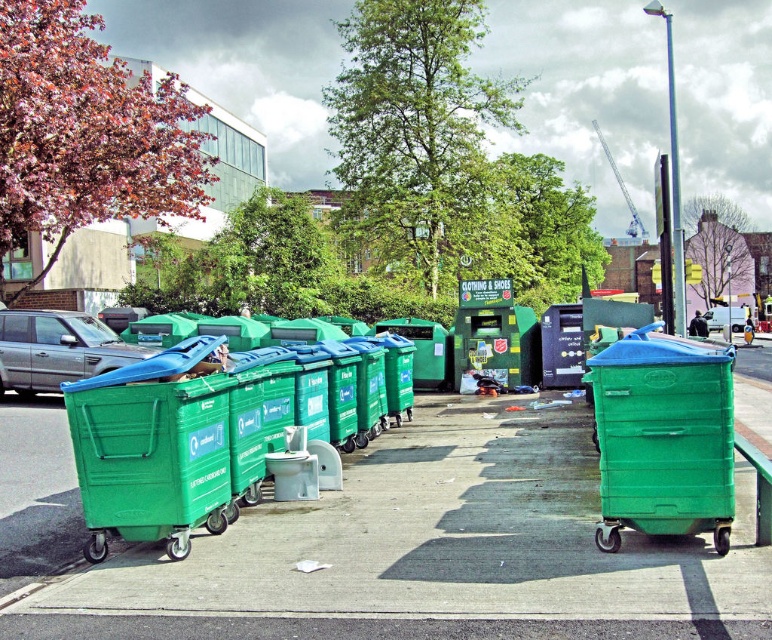
Question: From the image, what is the correct spatial relationship of green plastic pavement at center in relation to green plastic recycling bin at left?

Choices:
 (A) left
 (B) right

Answer: (B)

Question: Is green plastic recycling bin at left in front of silver metallic car at left?

Choices:
 (A) no
 (B) yes

Answer: (B)

Question: Which point is farther from the camera taking this photo?

Choices:
 (A) (80, 468)
 (B) (567, 592)
 (C) (174, 378)
 (D) (12, 376)

Answer: (D)

Question: Is green plastic pavement at center below green plastic bin at center?

Choices:
 (A) no
 (B) yes

Answer: (B)

Question: Which point is farther to the camera?

Choices:
 (A) green plastic bin at center
 (B) green plastic pavement at center

Answer: (A)

Question: Which object appears farthest from the camera in this image?

Choices:
 (A) metallic silver car at center
 (B) green plastic bin at center
 (C) green plastic recycling bin at left

Answer: (A)